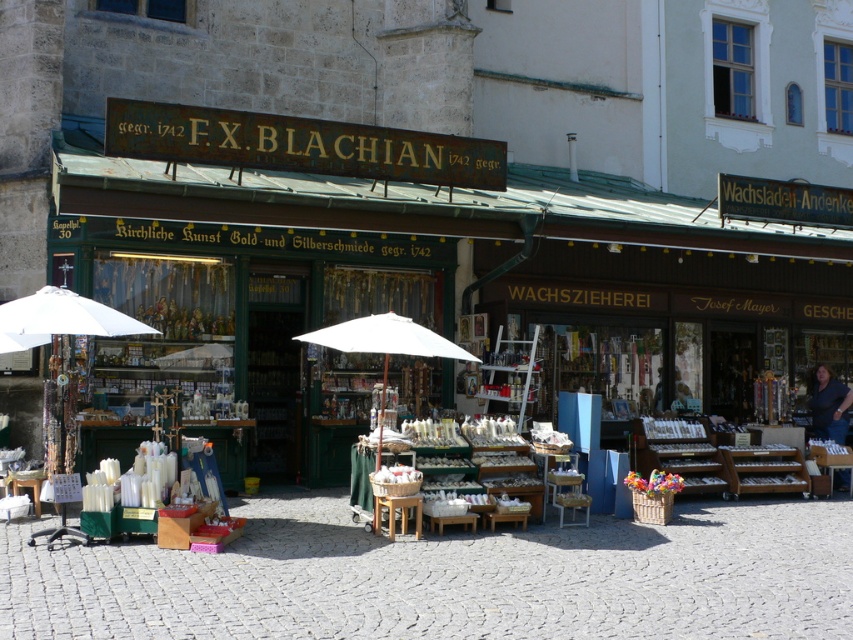
Question: In this image, where is white fabric umbrella at left located relative to blue fabric vendor at center?

Choices:
 (A) below
 (B) above

Answer: (B)

Question: Is white fabric umbrella at left wider than blue fabric vendor at center?

Choices:
 (A) yes
 (B) no

Answer: (A)

Question: Which object is closer to the camera taking this photo?

Choices:
 (A) white fabric umbrella at left
 (B) blue fabric vendor at center

Answer: (A)

Question: Does white fabric umbrella at left appear on the left side of blue fabric vendor at center?

Choices:
 (A) yes
 (B) no

Answer: (A)

Question: Which of the following is the farthest from the observer?

Choices:
 (A) blue fabric vendor at center
 (B) white fabric umbrella at left

Answer: (A)

Question: Which of the following is the closest to the observer?

Choices:
 (A) blue fabric vendor at center
 (B) white fabric umbrella at left

Answer: (B)